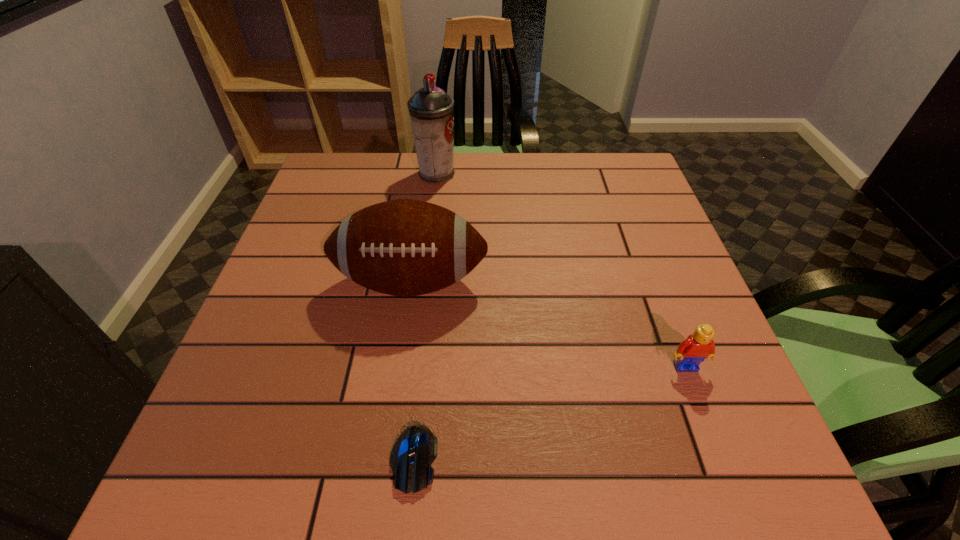
This screenshot has height=540, width=960. What are the coordinates of `the farthest object` in the screenshot? It's located at (431, 110).

At what (x,y) coordinates should I click in order to perform the action: click on the tallest object. Please return your answer as a coordinate pair (x, y). The width and height of the screenshot is (960, 540). Looking at the image, I should click on (431, 110).

I want to click on the second farthest object, so click(404, 247).

Locate an element on the screen. The height and width of the screenshot is (540, 960). football is located at coordinates (404, 247).

Locate an element on the screen. the third farthest object is located at coordinates (692, 351).

Locate an element on the screen. The image size is (960, 540). the rightmost object is located at coordinates (692, 351).

Where is `computer mouse`? computer mouse is located at coordinates (414, 451).

Image resolution: width=960 pixels, height=540 pixels. I want to click on the nearest object, so click(x=414, y=451).

Where is `free point located on the left of the aerosol can`? This screenshot has width=960, height=540. free point located on the left of the aerosol can is located at coordinates (352, 174).

You are a GUI agent. You are given a task and a screenshot of the screen. Output one action in this format:
    pyautogui.click(x=<x>, y=<y>)
    Task: Click on the vacant position located on the laces of the third nearest object
    This screenshot has width=960, height=540.
    Given the screenshot: What is the action you would take?
    [389, 431]